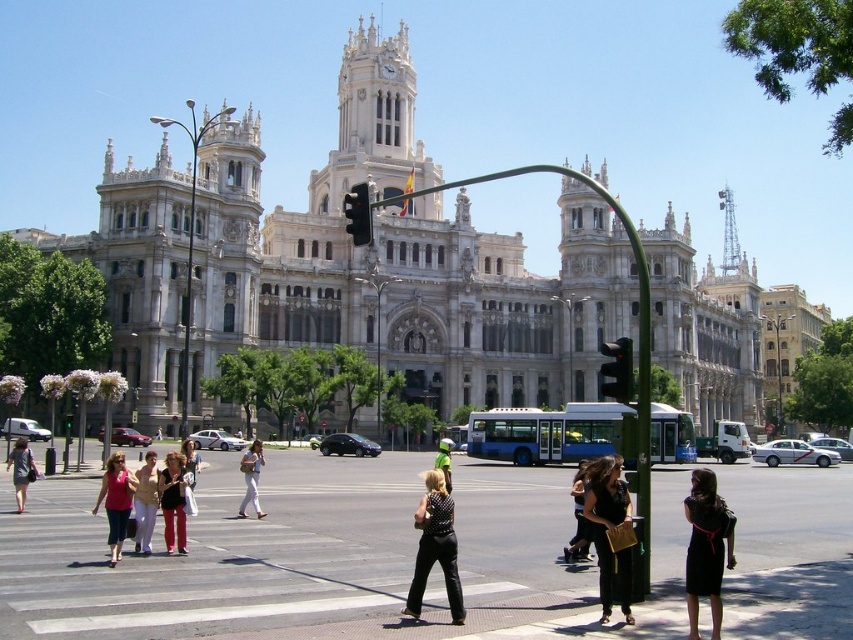
Question: Is black satin dress at lower right closer to the viewer compared to black leather dress at center?

Choices:
 (A) no
 (B) yes

Answer: (B)

Question: Considering the relative positions of red glass traffic light at center and matte black dress at lower left in the image provided, where is red glass traffic light at center located with respect to matte black dress at lower left?

Choices:
 (A) below
 (B) above

Answer: (B)

Question: Which of the following is the closest to the observer?

Choices:
 (A) red glass traffic light at center
 (B) black dress at center
 (C) light beige pants at center
 (D) denim pants at crosswalk center

Answer: (A)

Question: Estimate the real-world distances between objects in this image. Which object is closer to the white stone building at center?

Choices:
 (A) denim pants at center
 (B) red glass traffic light at center
 (C) black satin dress at lower right
 (D) green reflective vest at center

Answer: (B)

Question: Which object is farther from the camera taking this photo?

Choices:
 (A) black plastic traffic light at center
 (B) black leather dress at center

Answer: (A)

Question: Can you confirm if black matte pants at center is positioned to the left of black dress at center?

Choices:
 (A) no
 (B) yes

Answer: (B)